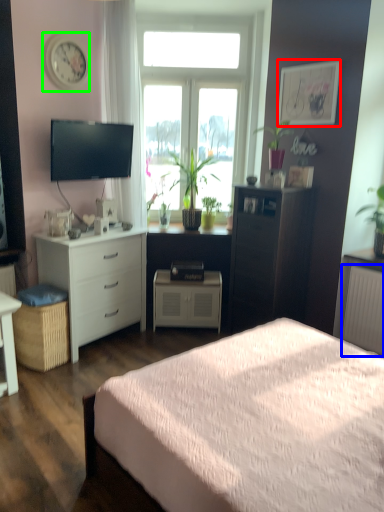
Question: Based on their relative distances, which object is farther from picture frame (highlighted by a red box)? Choose from radiator (highlighted by a blue box) and clock (highlighted by a green box).

Choices:
 (A) radiator
 (B) clock

Answer: (B)